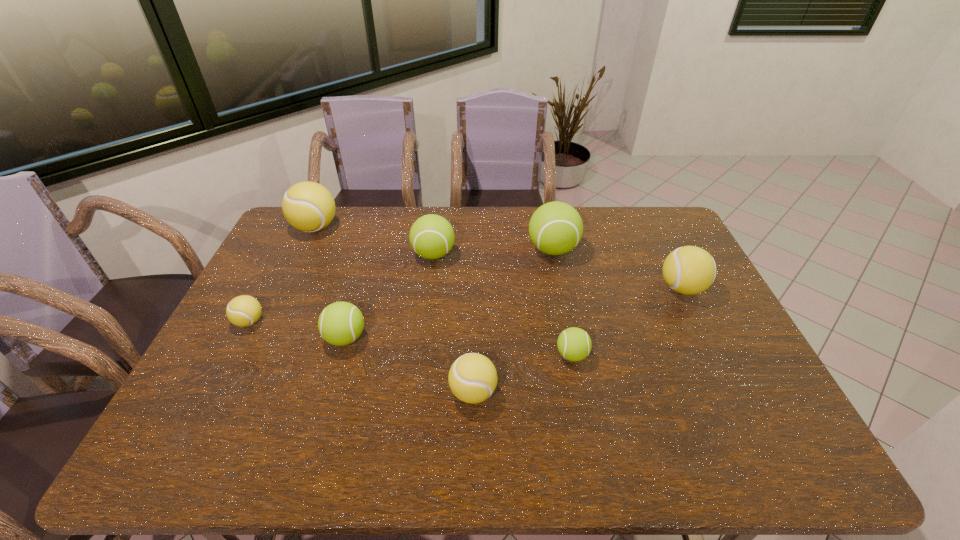
Locate which yellow tennis ball ranks in proximity to the smallest green tennis ball. Please provide its 2D coordinates. Your answer should be formatted as a tuple, i.e. [(x, y)], where the tuple contains the x and y coordinates of a point satisfying the conditions above.

[(472, 378)]

Point out which green tennis ball is positioned as the nearest to the smallest yellow tennis ball. Please provide its 2D coordinates. Your answer should be formatted as a tuple, i.e. [(x, y)], where the tuple contains the x and y coordinates of a point satisfying the conditions above.

[(341, 323)]

Find the location of a particular element. green tennis ball that stands as the third closest to the rightmost tennis ball is located at coordinates (431, 236).

Locate an element on the screen. free space that satisfies the following two spatial constraints: 1. on the front side of the second smallest yellow tennis ball; 2. on the right side of the third tennis ball from left to right is located at coordinates (329, 392).

The width and height of the screenshot is (960, 540). Find the location of `vacant point that satisfies the following two spatial constraints: 1. on the back side of the smallest green tennis ball; 2. on the right side of the rightmost object`. vacant point that satisfies the following two spatial constraints: 1. on the back side of the smallest green tennis ball; 2. on the right side of the rightmost object is located at coordinates (559, 288).

The image size is (960, 540). I want to click on free location that satisfies the following two spatial constraints: 1. on the back side of the rightmost object; 2. on the right side of the nearest yellow tennis ball, so click(474, 288).